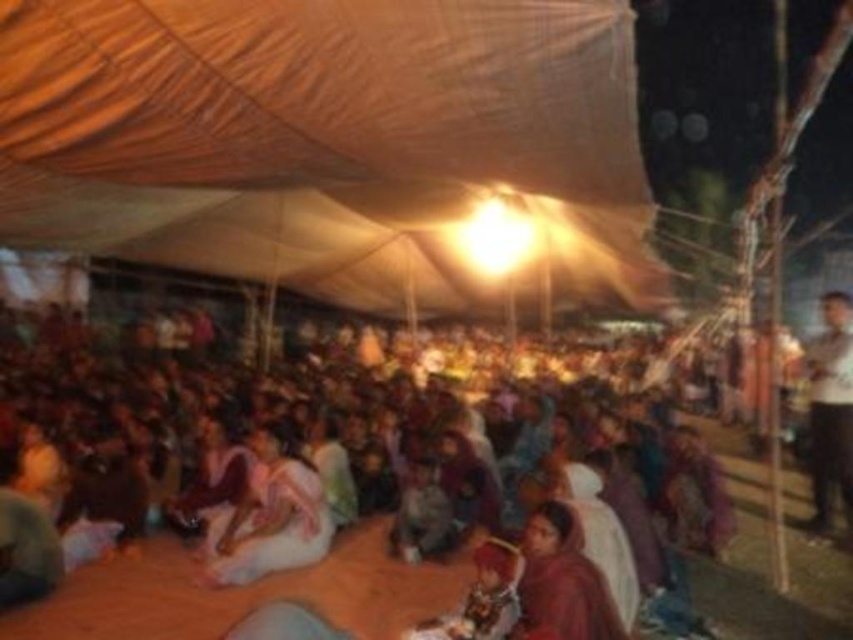
You are attending a cultural event under a tent and notice two items of clothing. The pink fabric at center is part of a ceremonial garment, and the white shirt at upper right belongs to a participant. From your perspective inside the tent, which clothing item is positioned lower in the scene?

The pink fabric at center is positioned lower than the white shirt at upper right because it is located below it.